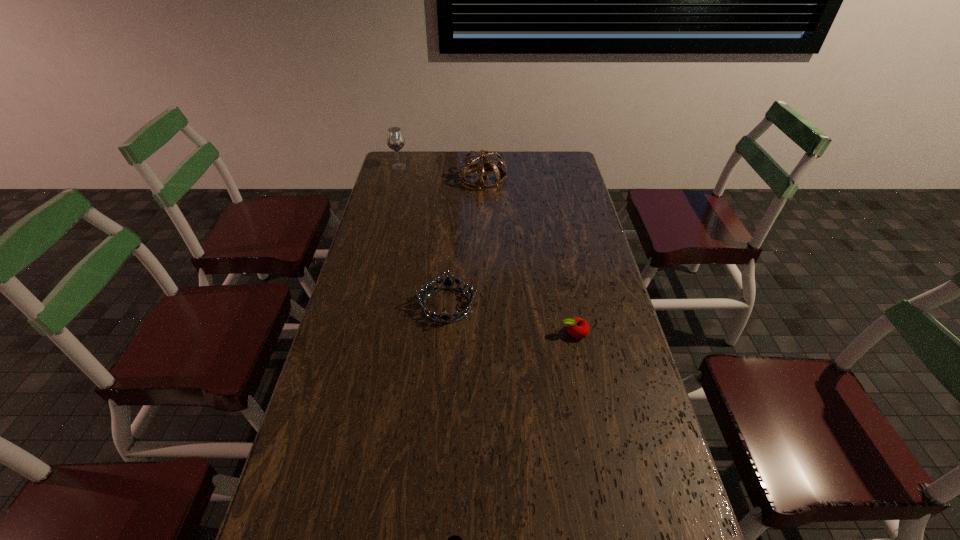
Find the location of a particular element. free spot between the rightmost object and the farther tiara is located at coordinates (528, 255).

At what (x,y) coordinates should I click in order to perform the action: click on vacant region between the tallest object and the rightmost object. Please return your answer as a coordinate pair (x, y). Looking at the image, I should click on click(487, 249).

Locate an element on the screen. The image size is (960, 540). unoccupied area between the fourth tallest object and the nearer tiara is located at coordinates (511, 319).

You are a GUI agent. You are given a task and a screenshot of the screen. Output one action in this format:
    pyautogui.click(x=<x>, y=<y>)
    Task: Click on the free space between the wineglass and the fourth tallest object
    
    Given the screenshot: What is the action you would take?
    pyautogui.click(x=487, y=249)

The width and height of the screenshot is (960, 540). I want to click on vacant area that lies between the shorter tiara and the apple, so [x=511, y=319].

Locate an element on the screen. This screenshot has width=960, height=540. free space between the shorter tiara and the leftmost object is located at coordinates (423, 236).

Image resolution: width=960 pixels, height=540 pixels. Identify the location of object that ranks as the closest to the nearer tiara. (578, 328).

Find the location of a particular element. The image size is (960, 540). object that can be found as the second closest to the shortest object is located at coordinates (578, 328).

Where is `free spot that satisfies the following two spatial constraints: 1. on the front-facing side of the rightmost object; 2. on the right side of the shorter tiara`? This screenshot has height=540, width=960. free spot that satisfies the following two spatial constraints: 1. on the front-facing side of the rightmost object; 2. on the right side of the shorter tiara is located at coordinates (445, 333).

What are the coordinates of `vacant space that satisfies the following two spatial constraints: 1. on the front-facing side of the fourth tallest object; 2. on the left side of the shorter tiara` in the screenshot? It's located at (445, 333).